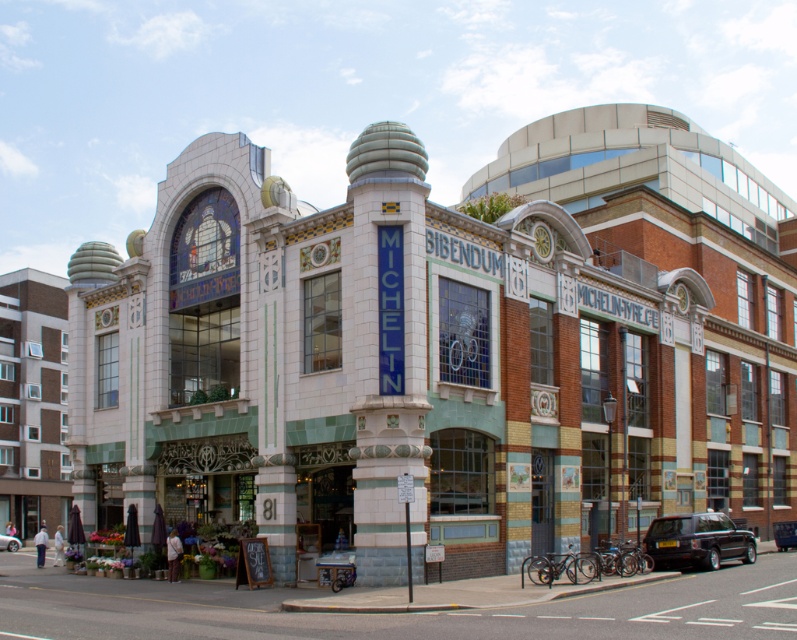
You are a visitor standing at the entrance of the building and want to take a photo of both the white tiled theater at center and the metallic silver car at center. Which object will appear larger in your camera view?

The white tiled theater at center will appear larger in your camera view because it is much taller than the metallic silver car at center.

You are a guest arriving at the BIBENDUM MICHELIN building. You see the white tiled theater at center and the metallic silver car at center. Which one is located to the right of the other?

The white tiled theater at center is positioned on the right side of the metallic silver car at center.

Consider the image. You are standing in front of the building and want to reach the point marked at coordinates point (558, 259). If your walking speed is 1.2 meters per second, how many seconds will it take you to reach that point?

The point (558, 259) is 57.17 meters away from the viewer. At a walking speed of 1.2 meters per second, it would take approximately 47.64 seconds to reach the point. Since we can round to the nearest whole number, it would take about 48 seconds.